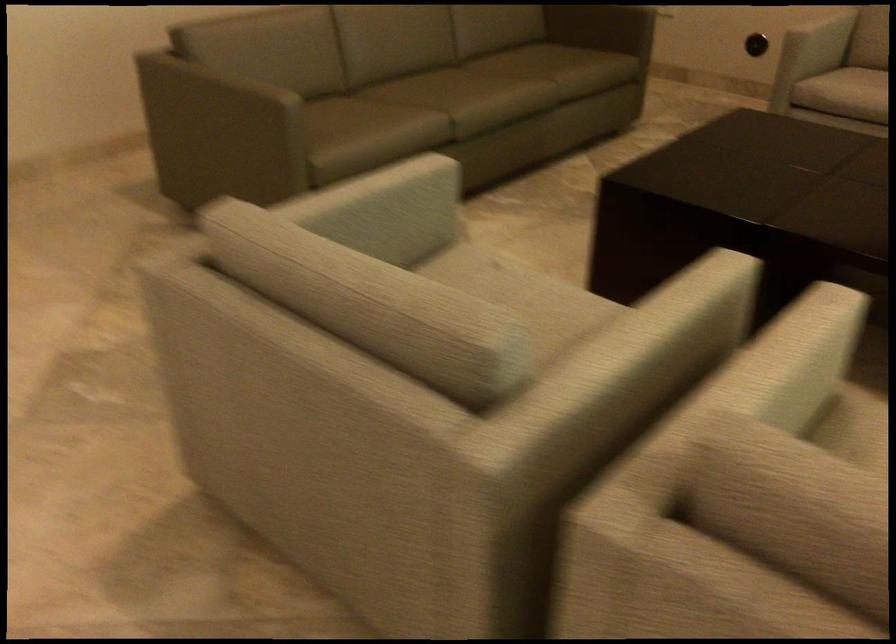
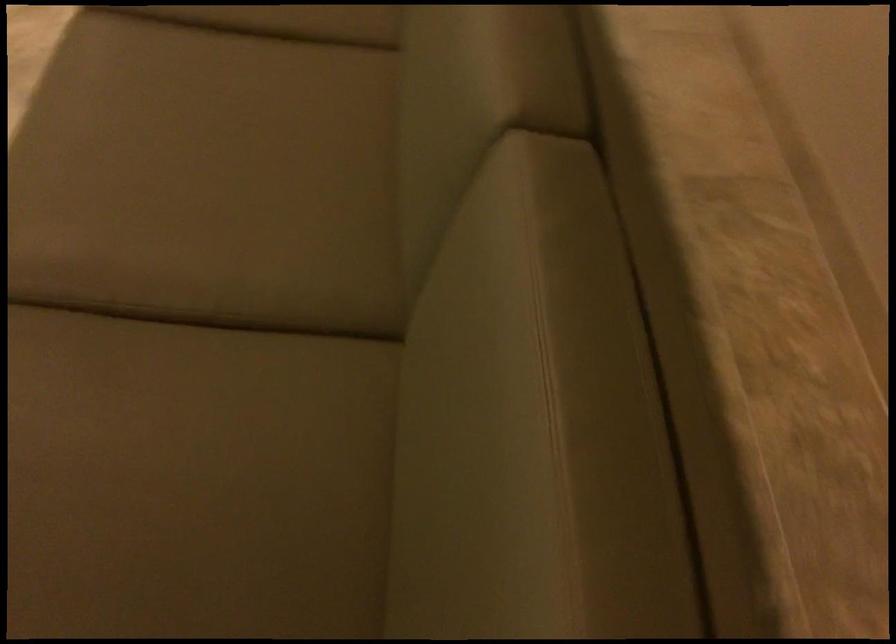
The point at (359,105) is marked in the first image. Where is the corresponding point in the second image?

(286, 20)